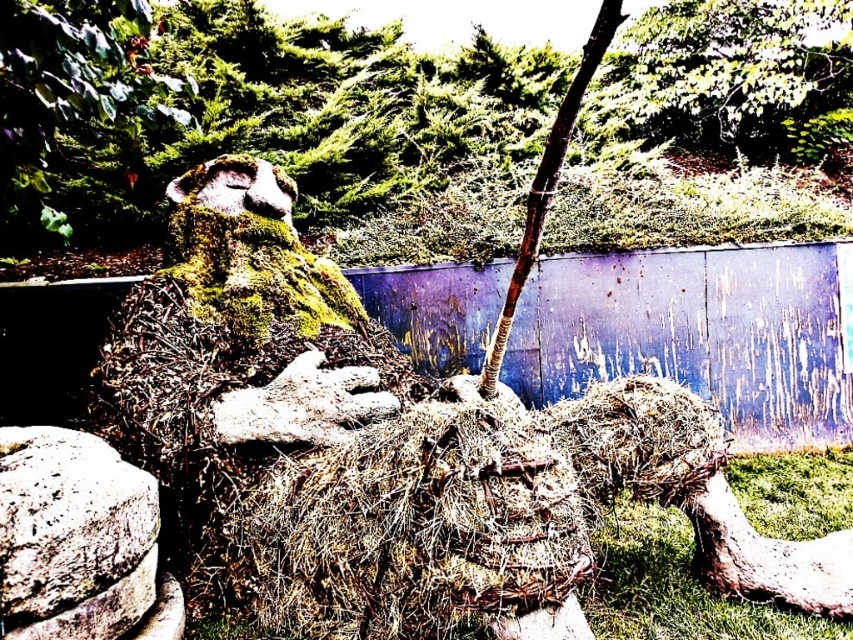
You are trying to place a decorative rock that is 10 cm wide. You have two options in the scene, the dry straw at center and the gray rough stone at lower left. Which object can the rock fit next to without overlapping?

The gray rough stone at lower left is narrower than the dry straw at center, so the 10 cm wide rock can fit next to the gray rough stone at lower left without overlapping.